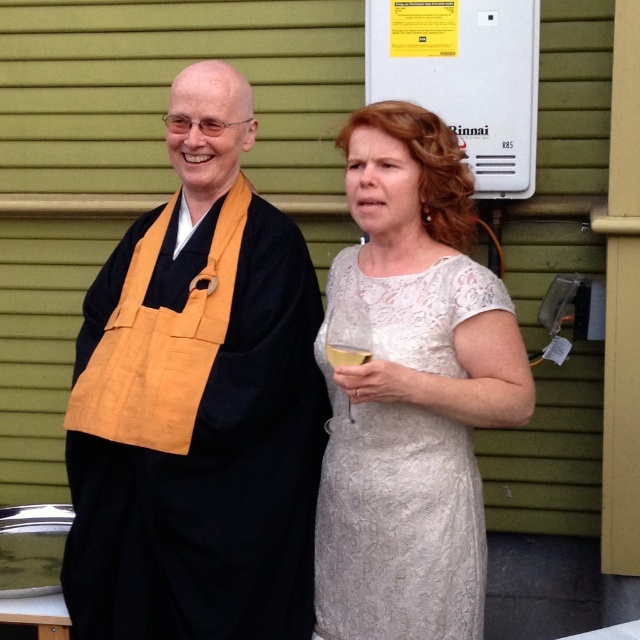
Between black matte kimono at left and lace fabric dress at center, which one is positioned higher?

black matte kimono at left is above.

Between point (253, 436) and point (426, 429), which one is positioned in front?

Point (426, 429)

The height and width of the screenshot is (640, 640). Find the location of `black matte kimono at left`. black matte kimono at left is located at coordinates (196, 403).

Does lace fabric dress at center appear on the left side of clear glass wine glass at lower center?

Incorrect, lace fabric dress at center is not on the left side of clear glass wine glass at lower center.

Does point (371, 284) come farther from viewer compared to point (330, 362)?

That is True.

This screenshot has width=640, height=640. What do you see at coordinates (403, 467) in the screenshot?
I see `lace fabric dress at center` at bounding box center [403, 467].

What are the coordinates of `lace fabric dress at center` in the screenshot? It's located at (403, 467).

Does black matte kimono at left appear over translucent glass at upper center?

No, black matte kimono at left is not above translucent glass at upper center.

Between black matte kimono at left and translucent glass at upper center, which one appears on the left side from the viewer's perspective?

Positioned to the left is black matte kimono at left.

Who is more distant from viewer, (140, 378) or (330, 348)?

The point (140, 378) is more distant.

I want to click on black matte kimono at left, so click(196, 403).